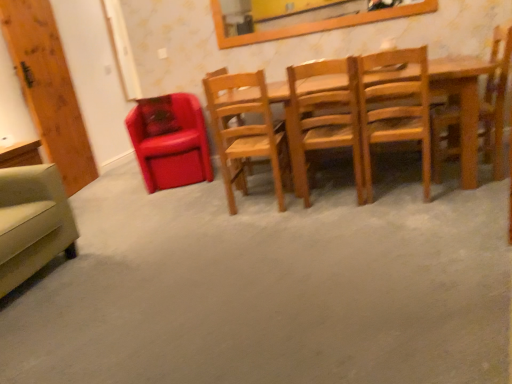
In order to click on vacant space positioned to the left of wooden chair at center, arranged as the 3th chair when viewed from the right in this screenshot , I will do `click(284, 210)`.